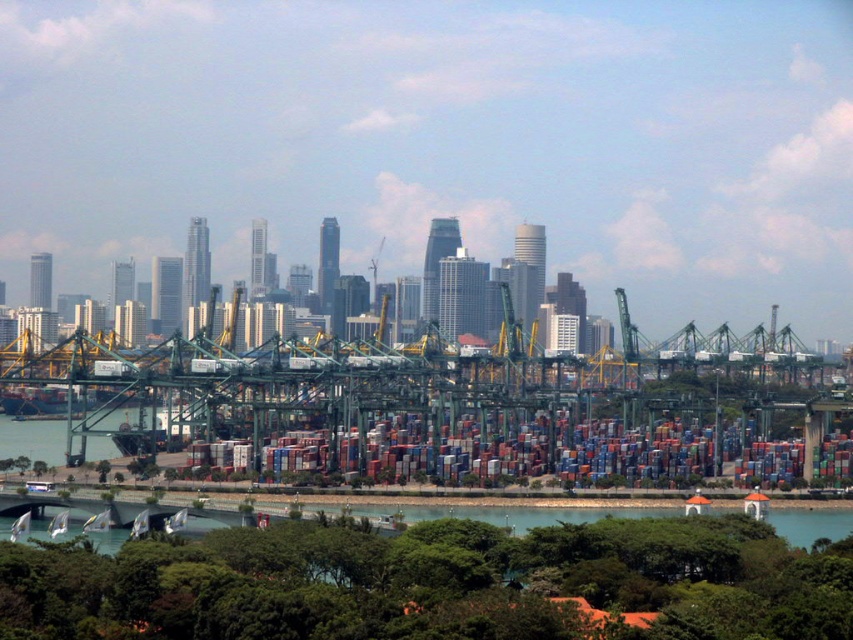
You are standing at the center of the port area and want to locate the metallic containers at center. According to the coordinates provided, where exactly should you look?

You should look at point (538, 452) to find the metallic containers at center.

You are a crane operator observing the port area. You need to move a container from the metallic containers at center to the green water at lower center. Which object is closer to your current position?

The metallic containers at center are closer to the viewer than the green water at lower center, so the metallic containers at center are closer to your current position.

You are standing at the edge of the port city looking towards the water. You notice two points marked in the scene. Which point is closer to you, point (x=462, y=428) or point (x=79, y=516)?

Point (x=462, y=428) is in front of point (x=79, y=516), so it is closer to you.